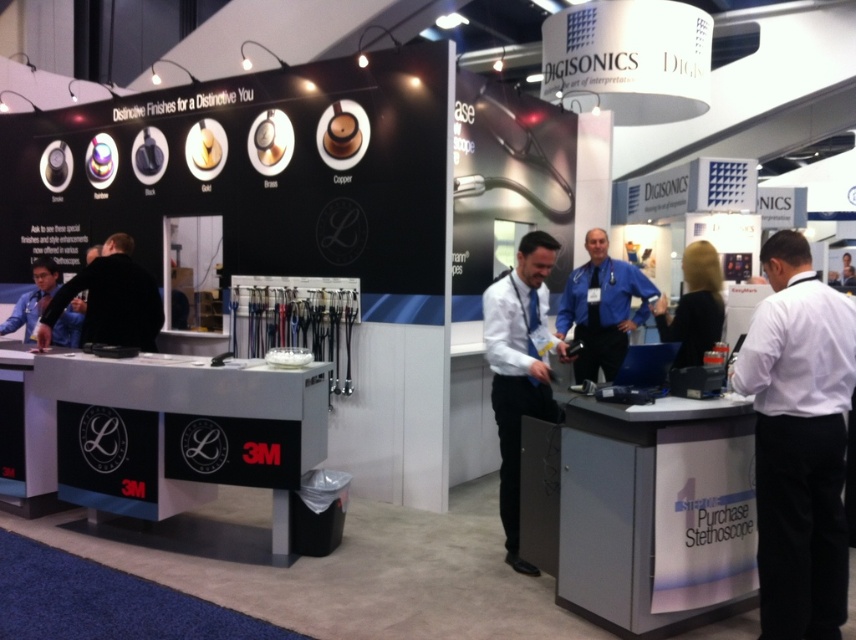
Does point (782, 449) lie in front of point (574, 362)?

Yes, point (782, 449) is closer to viewer.

Is white shirt at right bigger than blue uniform at center?

No.

This screenshot has height=640, width=856. What do you see at coordinates (798, 442) in the screenshot?
I see `white shirt at right` at bounding box center [798, 442].

The height and width of the screenshot is (640, 856). I want to click on white shirt at right, so click(x=798, y=442).

Can you confirm if blue uniform at center is thinner than black matte jacket at left?

Incorrect, blue uniform at center's width is not less than black matte jacket at left's.

Is blue uniform at center shorter than black matte jacket at left?

Incorrect, blue uniform at center's height does not fall short of black matte jacket at left's.

Is point (595, 260) positioned behind point (129, 260)?

Yes, it is.

Where is `blue uniform at center`? blue uniform at center is located at coordinates (602, 308).

Which is above, white shirt at right or black matte jacket at left?

black matte jacket at left is higher up.

Is white shirt at right above black matte jacket at left?

Actually, white shirt at right is below black matte jacket at left.

Which is in front, point (792, 388) or point (117, 234)?

Point (792, 388)

Find the location of a particular element. white shirt at right is located at coordinates (798, 442).